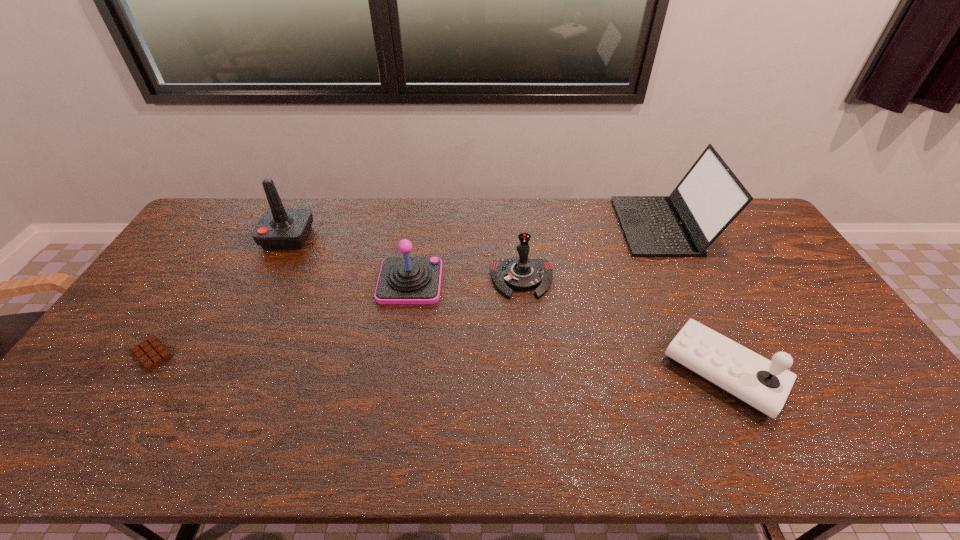
Image resolution: width=960 pixels, height=540 pixels. Find the location of `laptop`. laptop is located at coordinates (709, 197).

Find the location of `the tallest joystick`. the tallest joystick is located at coordinates (279, 228).

Locate an element on the screen. the leftmost joystick is located at coordinates (279, 228).

Locate an element on the screen. The height and width of the screenshot is (540, 960). the fourth object from right to left is located at coordinates (402, 280).

Identify the location of the third object from right to left. (521, 273).

The height and width of the screenshot is (540, 960). Identify the location of the rightmost joystick. [761, 385].

Find the location of a particular element. The image size is (960, 540). the leftmost object is located at coordinates (151, 352).

The width and height of the screenshot is (960, 540). In order to click on the shortest object in this screenshot , I will do `click(151, 352)`.

The width and height of the screenshot is (960, 540). What are the coordinates of `free space located on the surface of the laptop` in the screenshot? It's located at (520, 226).

The width and height of the screenshot is (960, 540). I want to click on vacant space located 0.360m on the surface of the laptop, so click(x=520, y=226).